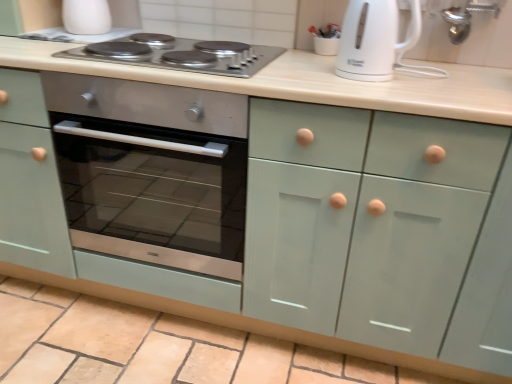
The image size is (512, 384). Find the location of `vacant space in front of white glossy electric kettle at upper right`. vacant space in front of white glossy electric kettle at upper right is located at coordinates (384, 94).